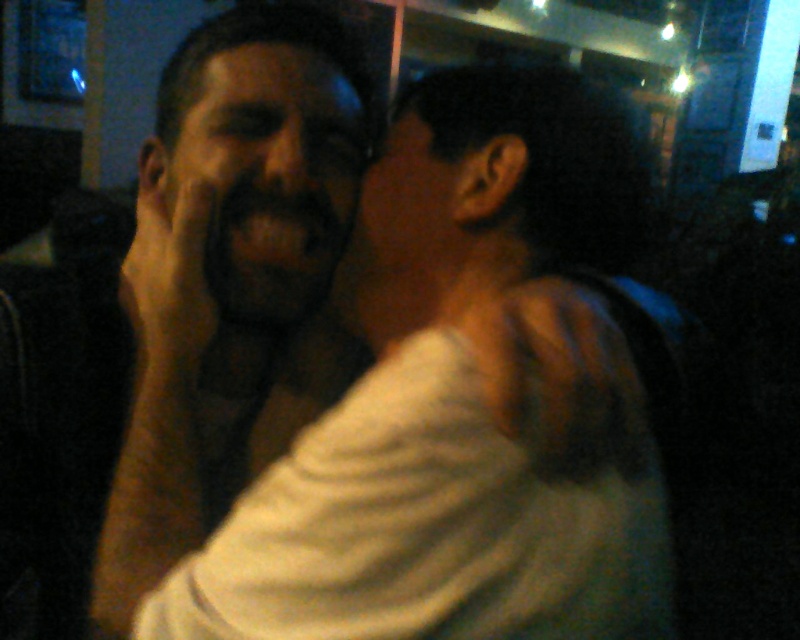
The image size is (800, 640). Identify the location of matte white shirt at center. (404, 401).

Between matte white shirt at center and dark matte face at center, which one has less height?

Standing shorter between the two is dark matte face at center.

Does point (450, 602) come in front of point (332, 262)?

That is True.

Find the location of a particular element. Image resolution: width=800 pixels, height=640 pixels. matte white shirt at center is located at coordinates (404, 401).